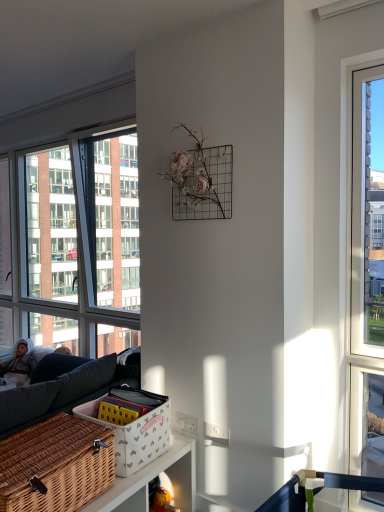
Question: Is fluffy white doll at left spatially inside clear glass window at left, or outside of it?

Choices:
 (A) outside
 (B) inside

Answer: (A)

Question: Is point (0, 381) positioned closer to the camera than point (79, 237)?

Choices:
 (A) farther
 (B) closer

Answer: (B)

Question: Estimate the real-world distances between objects in this image. Which object is farther from the white wicker basket at lower center?

Choices:
 (A) woven brown picnic basket at lower left
 (B) fluffy white doll at left
 (C) clear glass window at left

Answer: (C)

Question: Which object is positioned closest to the fluffy white doll at left?

Choices:
 (A) white wicker basket at lower center
 (B) woven brown picnic basket at lower left
 (C) clear glass window at left

Answer: (C)